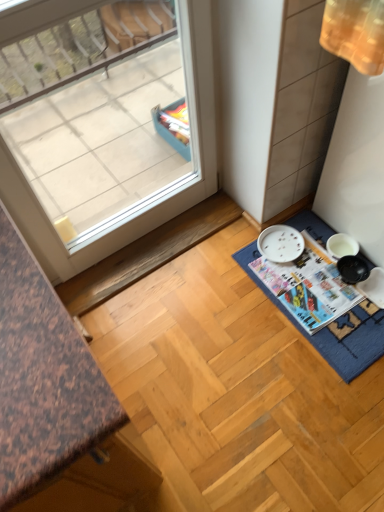
You are a GUI agent. You are given a task and a screenshot of the screen. Output one action in this format:
    pyautogui.click(x=<x>, y=<y>)
    Task: Click on the free point above blue fabric bath mat at lower right (from a real-world perspective)
    The image size is (384, 512).
    Given the screenshot: What is the action you would take?
    pyautogui.click(x=322, y=286)